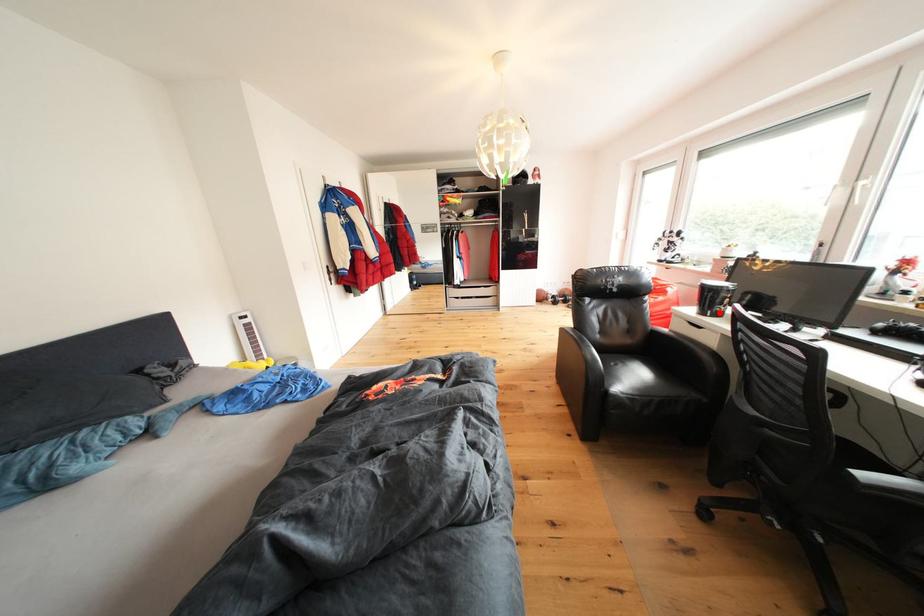
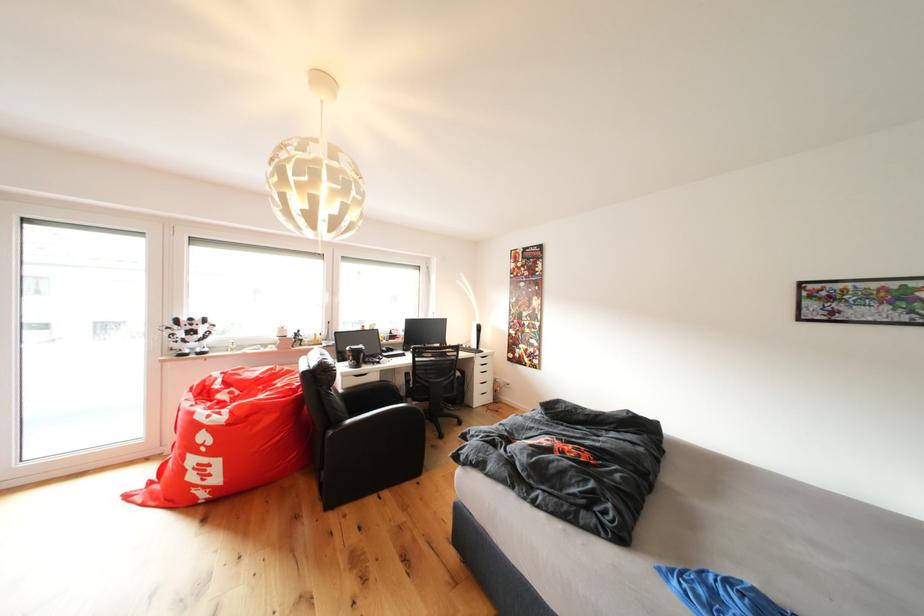
Question: I am providing you with two images of the same scene from different viewpoints. A red point is marked on the first image. At the location where the point appears in image 1, is it still visible in image 2?

Choices:
 (A) Yes
 (B) No

Answer: (B)